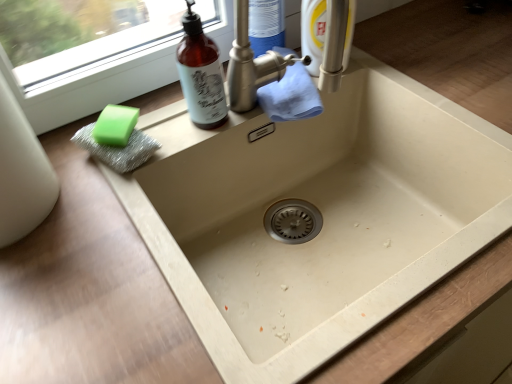
What are the coordinates of `spots to the right of green sponge at left` in the screenshot? It's located at (196, 130).